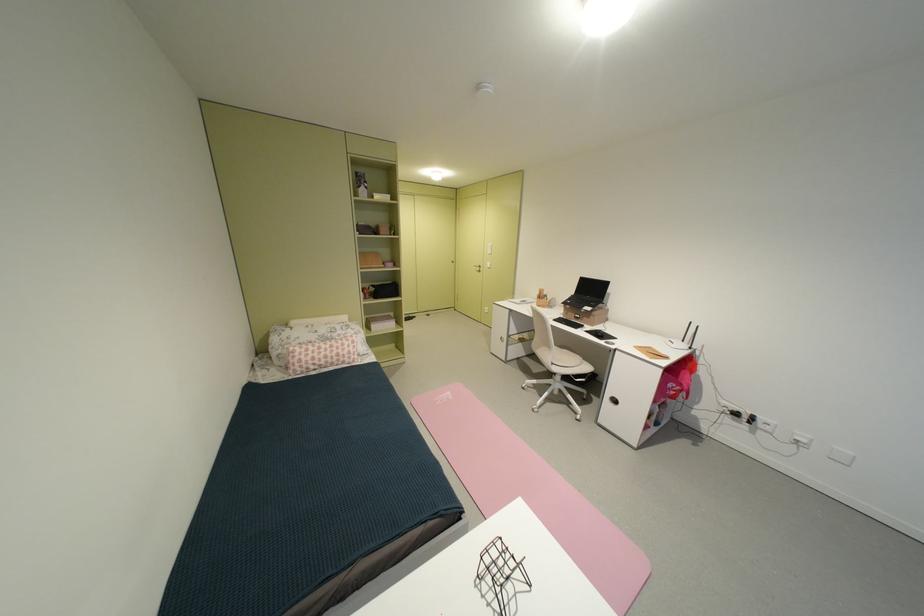
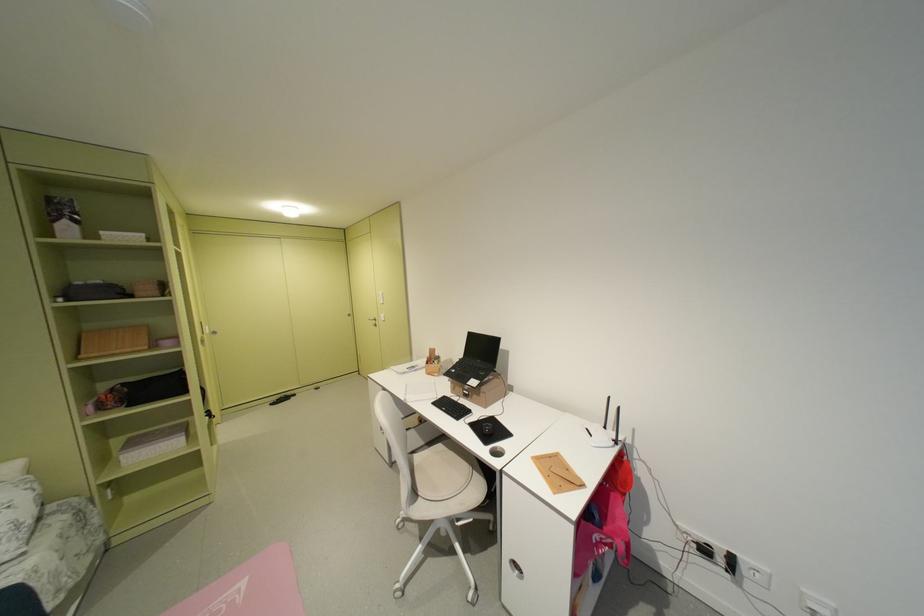
The images are taken continuously from a first-person perspective. In which direction are you moving?

The cameraman walked toward right, forward.